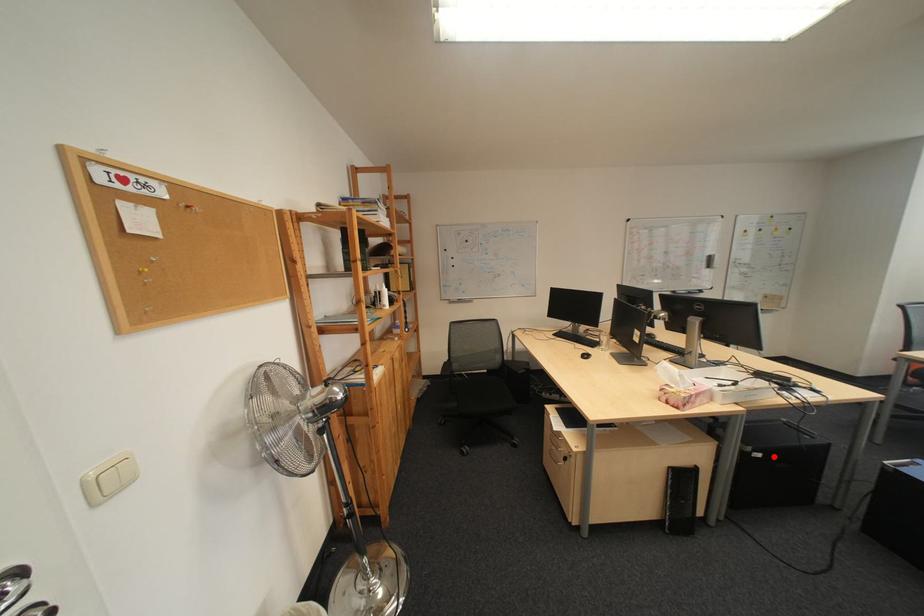
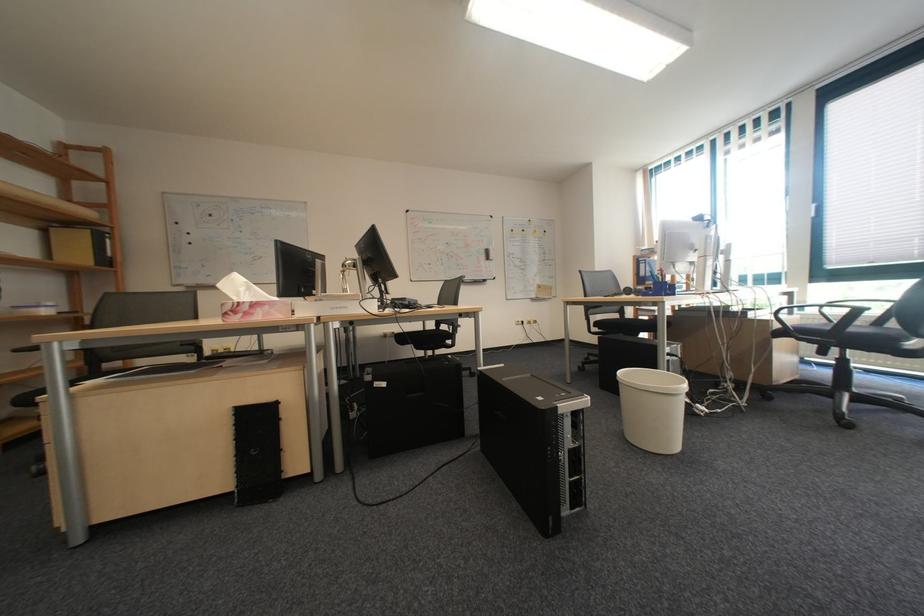
Find the pixel in the second image that matches the highlighted location in the first image.

(398, 386)